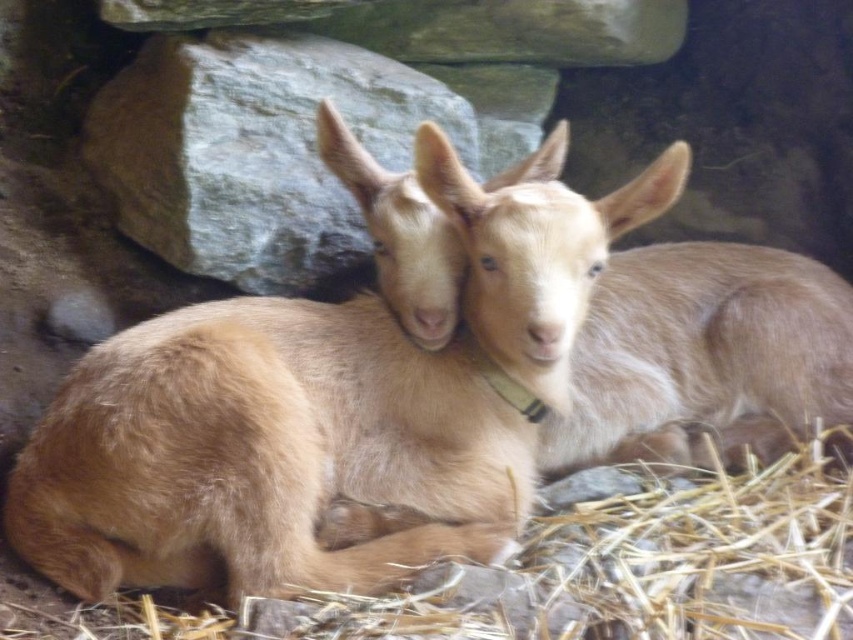
Does light brown fur goat at center come behind light brown fur at center?

No, it is in front of light brown fur at center.

Is light brown fur goat at center shorter than light brown fur at center?

No, light brown fur goat at center is not shorter than light brown fur at center.

Between point (469, 280) and point (848, 387), which one is positioned in front?

Point (469, 280) is in front.

Image resolution: width=853 pixels, height=640 pixels. What are the coordinates of `light brown fur goat at center` in the screenshot? It's located at (332, 397).

Who is positioned more to the right, brown straw at lower center or light brown fur at center?

light brown fur at center

This screenshot has height=640, width=853. I want to click on brown straw at lower center, so click(x=567, y=572).

Find the location of a particular element. Image resolution: width=853 pixels, height=640 pixels. brown straw at lower center is located at coordinates (567, 572).

The height and width of the screenshot is (640, 853). In order to click on light brown fur goat at center in this screenshot , I will do click(332, 397).

Who is taller, light brown fur goat at center or brown straw at lower center?

light brown fur goat at center

Between point (230, 426) and point (463, 586), which one is positioned in front?

Point (230, 426)

I want to click on light brown fur goat at center, so click(332, 397).